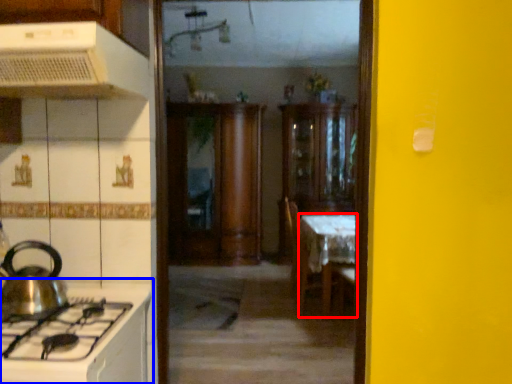
Question: Which object appears closest to the camera in this image, table (highlighted by a red box) or countertop (highlighted by a blue box)?

Choices:
 (A) table
 (B) countertop

Answer: (B)